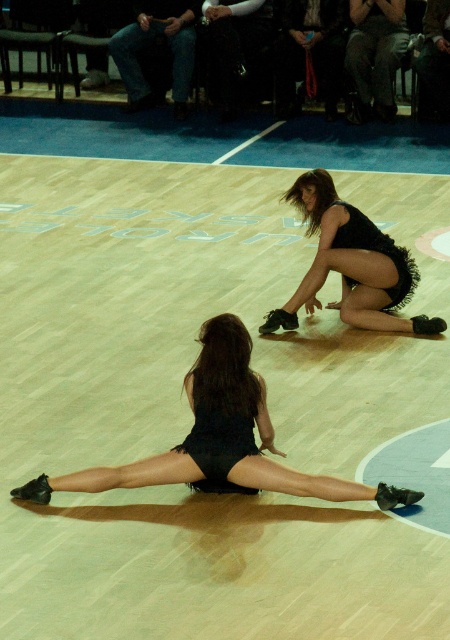
Between black feathered skirt at center and black sequined dress at lower center, which one appears on the left side from the viewer's perspective?

black sequined dress at lower center is more to the left.

Image resolution: width=450 pixels, height=640 pixels. What do you see at coordinates (351, 264) in the screenshot?
I see `black feathered skirt at center` at bounding box center [351, 264].

Is point (282, 317) closer to camera compared to point (235, 451)?

No, it is behind (235, 451).

Find the location of a particular element. The width and height of the screenshot is (450, 640). black feathered skirt at center is located at coordinates (351, 264).

The height and width of the screenshot is (640, 450). Describe the element at coordinates (220, 438) in the screenshot. I see `black fringed skirt at lower center` at that location.

Is point (396, 493) farther from camera compared to point (383, 275)?

No, (396, 493) is in front of (383, 275).

Find the location of a particular element. This screenshot has height=640, width=450. black fringed skirt at lower center is located at coordinates (220, 438).

Can you confirm if black sequined dress at lower center is positioned below black fringed skirt at center?

Correct, black sequined dress at lower center is located below black fringed skirt at center.

Locate an element on the screen. black sequined dress at lower center is located at coordinates (217, 444).